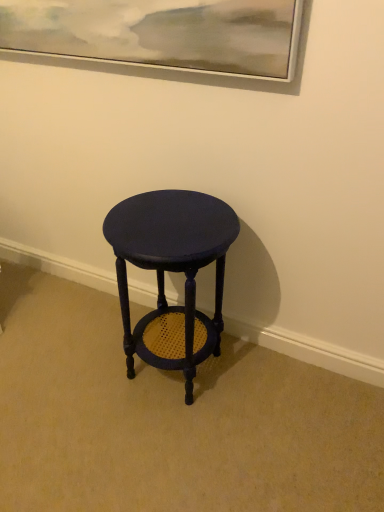
Measure the distance between point (216, 290) and camera.

Point (216, 290) is 5.04 feet away from camera.

Identify the location of matte black stool at center. click(x=172, y=271).

Image resolution: width=384 pixels, height=512 pixels. What do you see at coordinates (172, 271) in the screenshot?
I see `matte black stool at center` at bounding box center [172, 271].

Where is `matte black stool at center`? matte black stool at center is located at coordinates (172, 271).